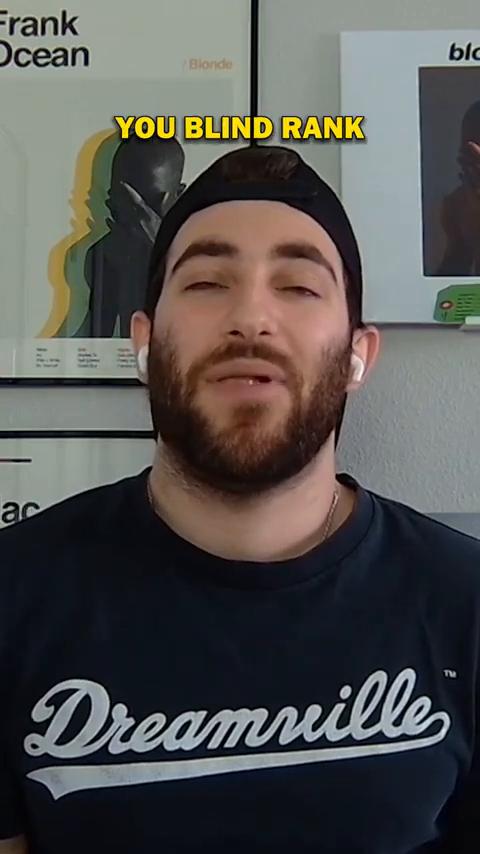
This screenshot has width=480, height=854. What are the coordinates of `frames` in the screenshot? It's located at (96, 430), (256, 66).